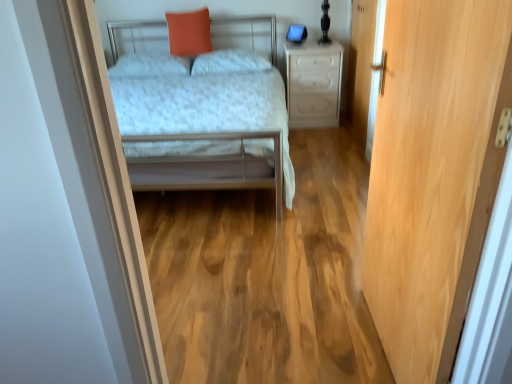
Question: Considering the relative positions of white plastic drawer at center and orange matte pillow at upper center in the image provided, is white plastic drawer at center behind orange matte pillow at upper center?

Choices:
 (A) no
 (B) yes

Answer: (A)

Question: Is white plastic drawer at center wider than orange matte pillow at upper center?

Choices:
 (A) no
 (B) yes

Answer: (B)

Question: Is white plastic drawer at center at the left side of orange matte pillow at upper center?

Choices:
 (A) yes
 (B) no

Answer: (B)

Question: From a real-world perspective, is white plastic drawer at center below orange matte pillow at upper center?

Choices:
 (A) yes
 (B) no

Answer: (A)

Question: From the image's perspective, would you say white plastic drawer at center is positioned over orange matte pillow at upper center?

Choices:
 (A) no
 (B) yes

Answer: (A)

Question: Considering the relative sizes of white plastic drawer at center and orange matte pillow at upper center in the image provided, is white plastic drawer at center shorter than orange matte pillow at upper center?

Choices:
 (A) yes
 (B) no

Answer: (B)

Question: Is white soft pillow at center, which is the first pillow in right-to-left order, facing towards white soft pillow at center, which is the first pillow from left to right?

Choices:
 (A) yes
 (B) no

Answer: (B)

Question: From a real-world perspective, is white soft pillow at center, which ranks as the second pillow in left-to-right order, positioned over white soft pillow at center, which is the first pillow from left to right, based on gravity?

Choices:
 (A) yes
 (B) no

Answer: (A)

Question: Is white soft pillow at center, which ranks as the second pillow in left-to-right order, not inside white soft pillow at center, acting as the 2th pillow starting from the right?

Choices:
 (A) no
 (B) yes

Answer: (B)

Question: Are white soft pillow at center, which is the first pillow in right-to-left order, and white soft pillow at center, acting as the 2th pillow starting from the right, far apart?

Choices:
 (A) yes
 (B) no

Answer: (B)

Question: Can you confirm if white soft pillow at center, which is the first pillow in right-to-left order, is bigger than white soft pillow at center, acting as the 2th pillow starting from the right?

Choices:
 (A) no
 (B) yes

Answer: (B)

Question: Is white soft pillow at center, which is the first pillow in right-to-left order, thinner than white soft pillow at center, acting as the 2th pillow starting from the right?

Choices:
 (A) yes
 (B) no

Answer: (B)

Question: Considering the relative sizes of metallic silver bed at center and white soft pillow at center, which is the first pillow from left to right, in the image provided, is metallic silver bed at center wider than white soft pillow at center, which is the first pillow from left to right,?

Choices:
 (A) no
 (B) yes

Answer: (B)